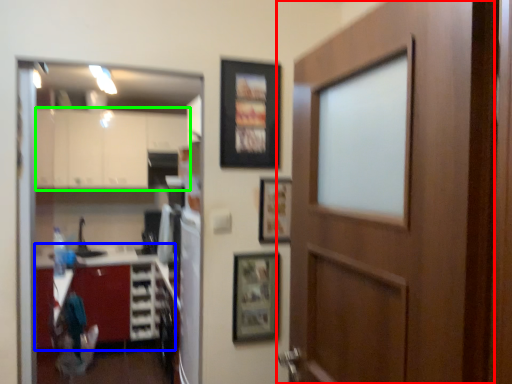
Question: Which object is the closest to the door (highlighted by a red box)? Choose among these: cabinetry (highlighted by a blue box) or cabinetry (highlighted by a green box).

Choices:
 (A) cabinetry
 (B) cabinetry

Answer: (A)